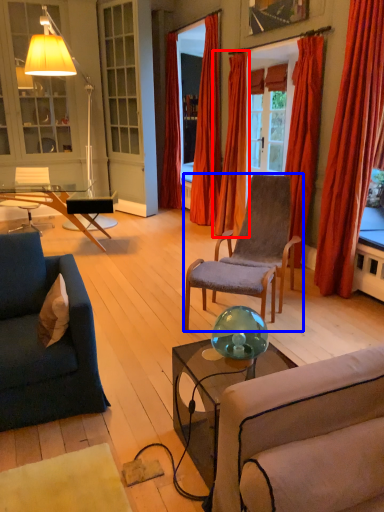
Question: Among these objects, which one is farthest to the camera, curtain (highlighted by a red box) or chair (highlighted by a blue box)?

Choices:
 (A) curtain
 (B) chair

Answer: (A)